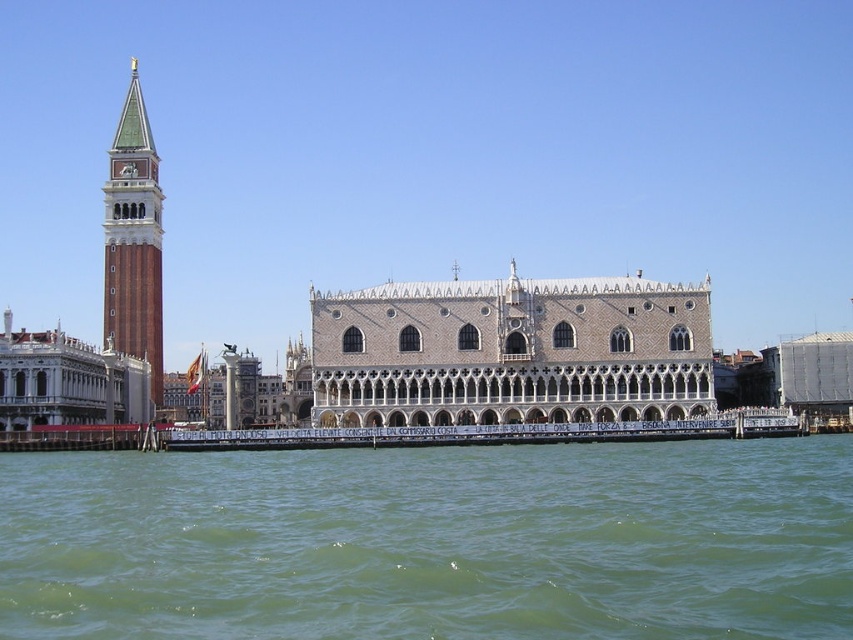
You are standing at the point labeled as point (432, 541) in the image. Based on the scene description, what can you see directly below you?

The point (432, 541) corresponds to green water at lower center, so you can see the green water at lower center directly below you.

You are standing on a boat in the canal near the Doge Palace. You see two points marked on the image. The first point is at coordinates point (91, 520) and the second point is at coordinates point (431, 358). Which point is closer to you?

Point (91, 520) is in front of point (431, 358), so the first point is closer to you.